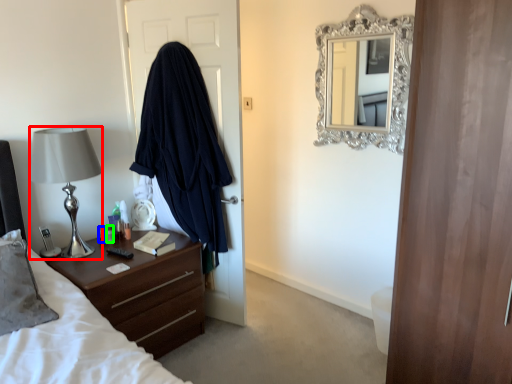
Question: Which is farther away from lamp (highlighted by a red box)? bottle (highlighted by a blue box) or bottle (highlighted by a green box)?

Choices:
 (A) bottle
 (B) bottle

Answer: (A)